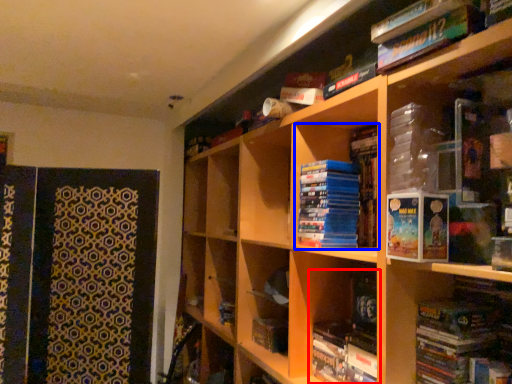
Question: Which object appears farthest to the camera in this image, book (highlighted by a red box) or book (highlighted by a blue box)?

Choices:
 (A) book
 (B) book

Answer: (B)